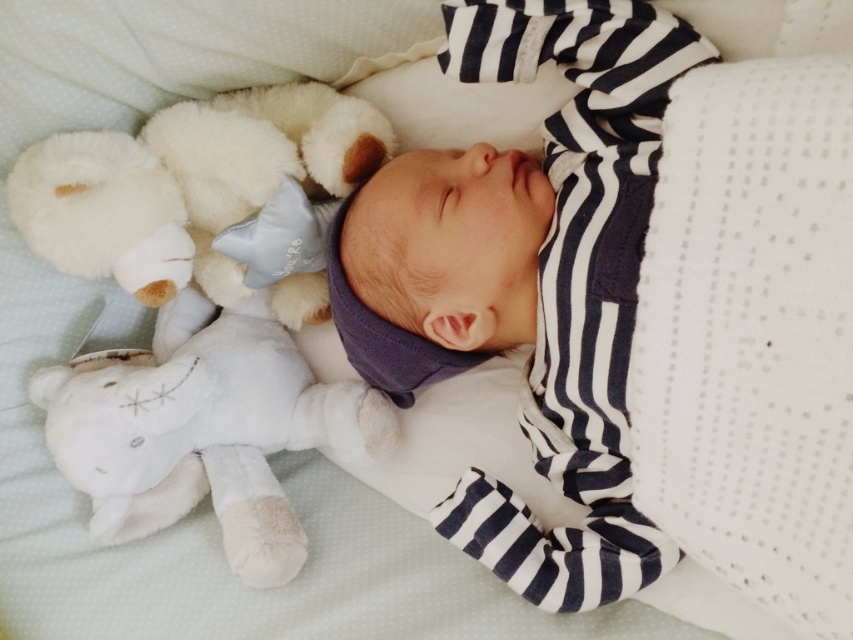
You are a parent checking on your baby. You notice two white plush toys at the upper left of the crib. Which one is closer to the baby, the white plush bear at upper left or the white plush teddy bear at upper left?

The white plush bear at upper left is closer to the baby because the white plush teddy bear at upper left is behind it.